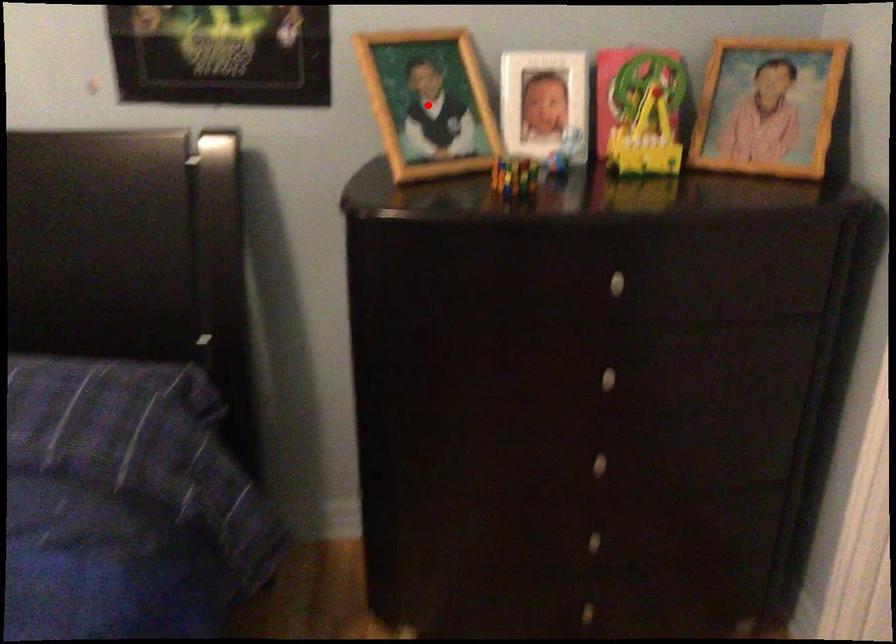
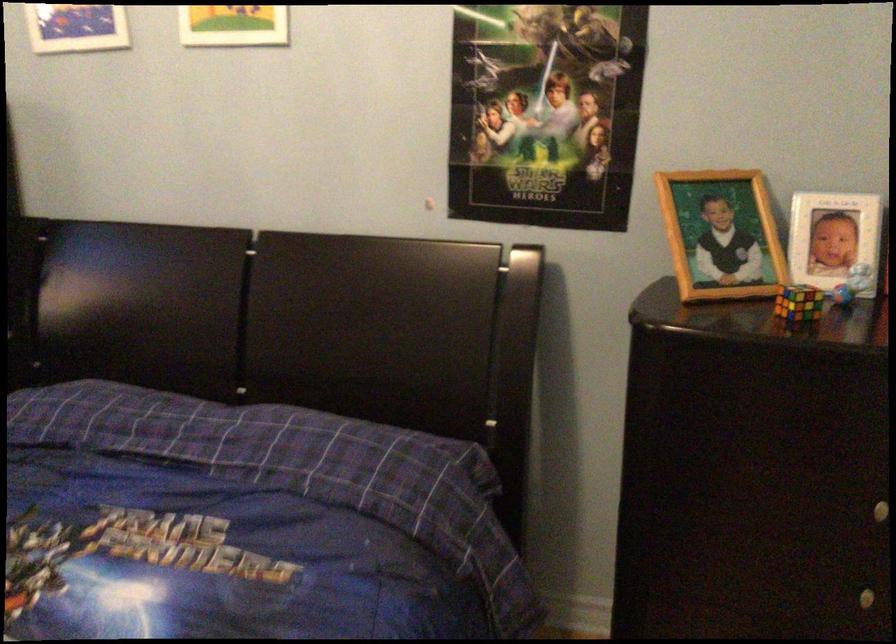
The point at the highlighted location is marked in the first image. Where is the corresponding point in the second image?

(720, 234)